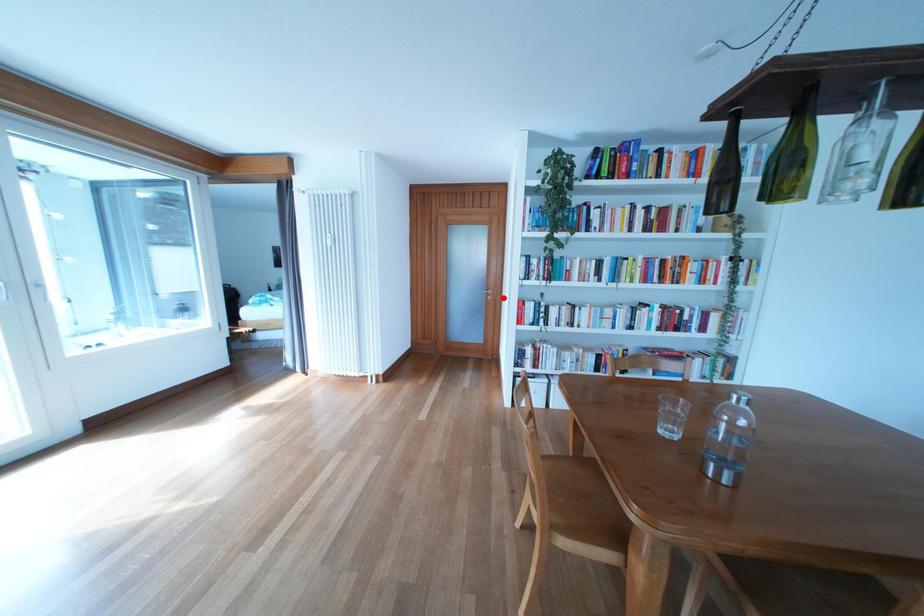
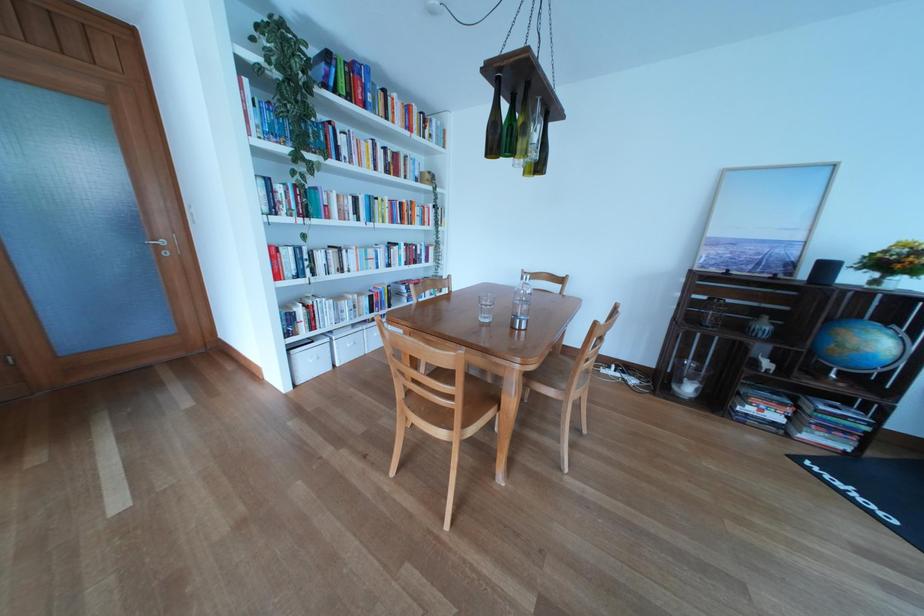
Find the pixel in the second image that matches the highlighted location in the first image.

(176, 248)